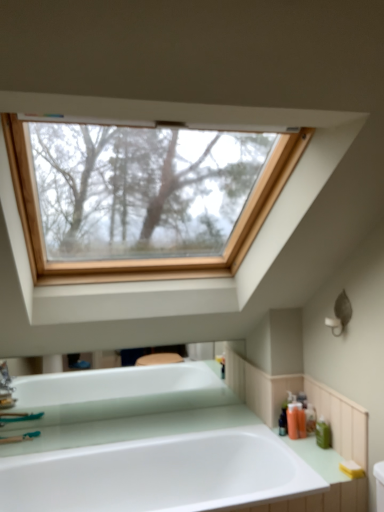
This screenshot has width=384, height=512. I want to click on free space in front of orange matte bottle at lower right, which is the third toiletry in back-to-front order, so click(x=302, y=453).